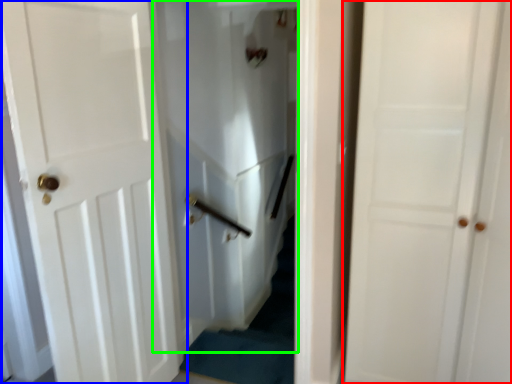
Question: Considering the real-world distances, which object is closest to door (highlighted by a red box)? door (highlighted by a blue box) or elevator (highlighted by a green box).

Choices:
 (A) door
 (B) elevator

Answer: (A)